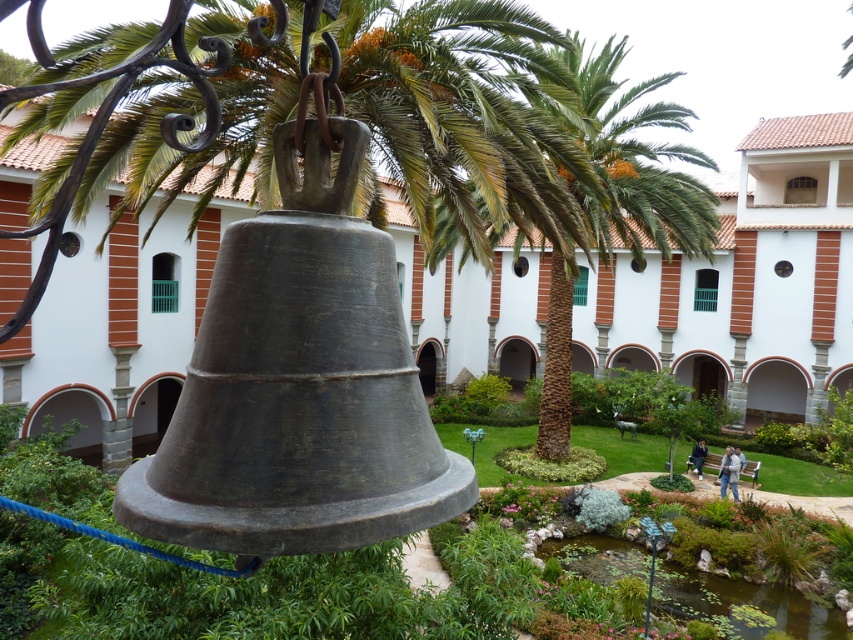
Is green leafy palm tree at center smaller than green lily pads at lower center?

Actually, green leafy palm tree at center might be larger than green lily pads at lower center.

Who is positioned more to the left, green leafy palm tree at center or green lily pads at lower center?

green leafy palm tree at center

Is point (611, 193) farther from viewer compared to point (709, 600)?

That is True.

This screenshot has width=853, height=640. Find the location of `green leafy palm tree at center`. green leafy palm tree at center is located at coordinates (634, 163).